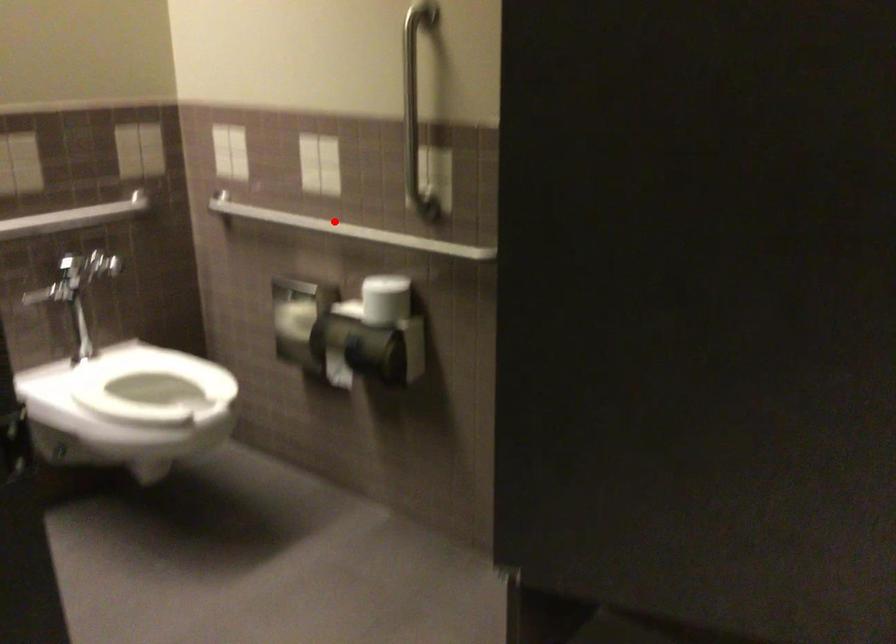
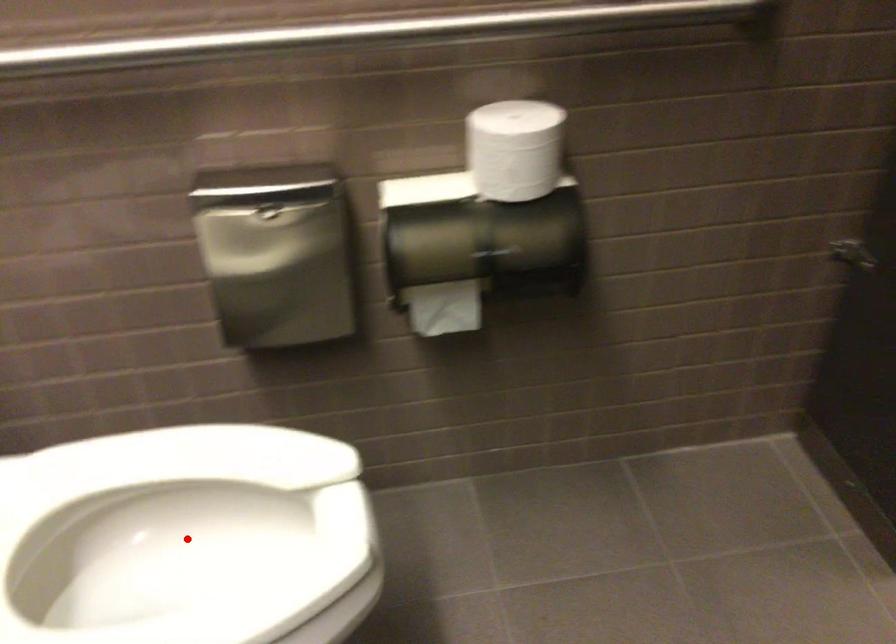
I am providing you with two images of the same scene from different viewpoints. A red point is marked on the first image and another point is marked on the second image. Are the points marked in image1 and image2 representing the same 3D position?

No